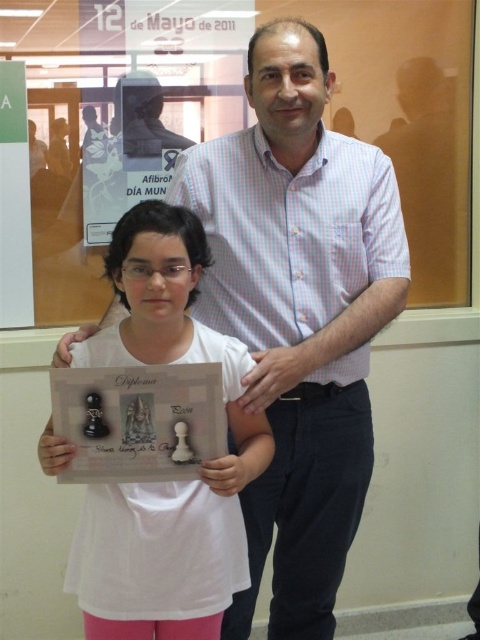
You are standing at the origin point in the image and want to move towards the two points labeled as point (120, 291) and point (159, 456). Which point should you aim for first if you want to reach the one that is closer to you?

Point (159, 456) is closer to you than point (120, 291), so you should aim for point (159, 456) first.

You are standing in the room and want to locate the light blue checkered shirt at center. Which object in the scene is exactly at the coordinates point (299, 314)?

The point (299, 314) corresponds to the light blue checkered shirt at center, so the light blue checkered shirt at center is exactly at that coordinate.

You are organizing a photo album and want to ensure the image is correctly labeled. Based on the scene, which object is closer to the viewer between the light blue checkered shirt at center and the matte paper plaque at center?

The light blue checkered shirt at center is positioned over the matte paper plaque at center, so it is closer to the viewer.